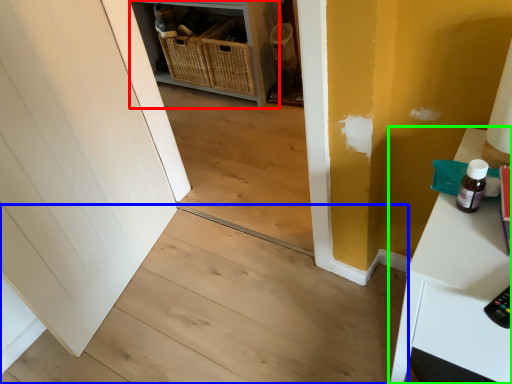
Question: Based on their relative distances, which object is farther from shelf (highlighted by a red box)? Choose from stair (highlighted by a blue box) and table (highlighted by a green box).

Choices:
 (A) stair
 (B) table

Answer: (B)